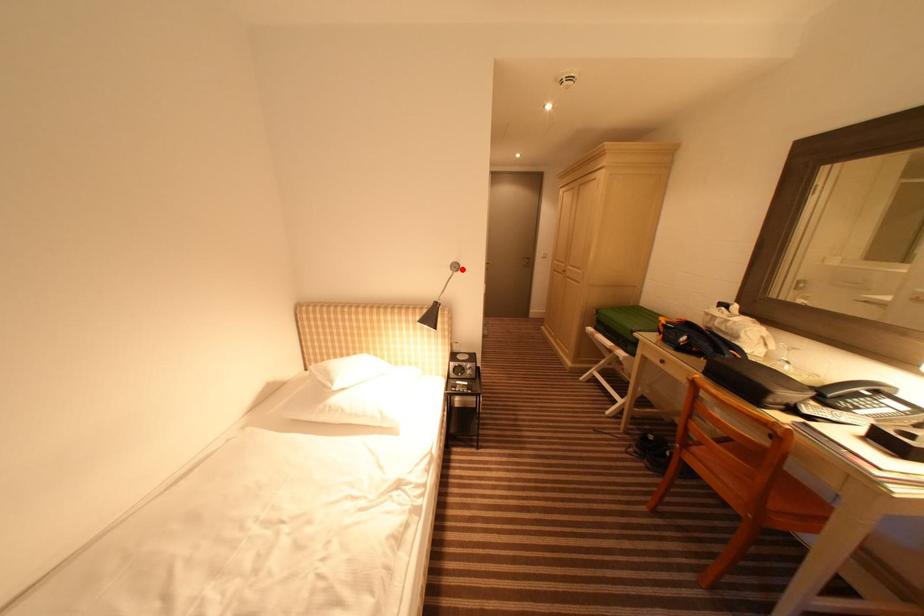
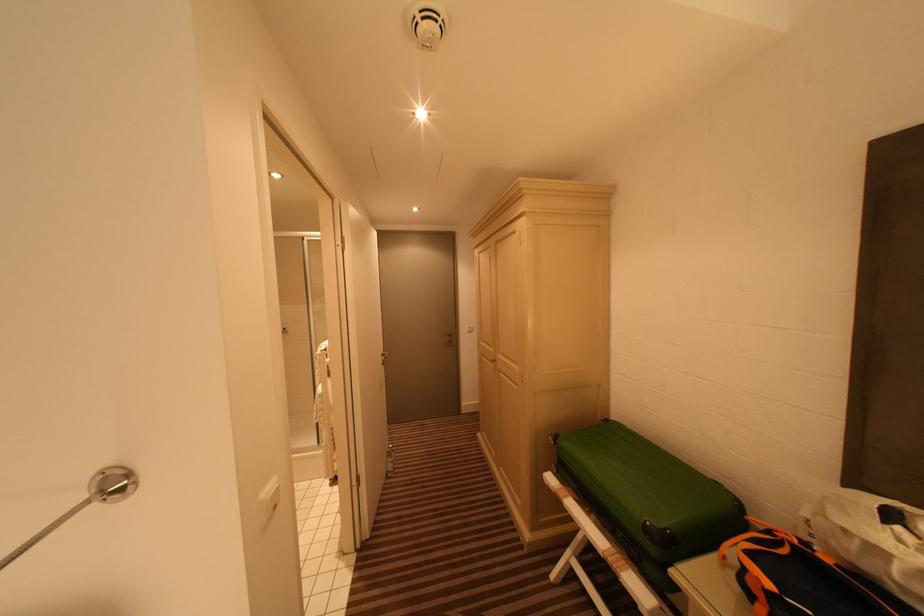
Locate, in the second image, the point that corresponds to the highlighted location in the first image.

(120, 488)